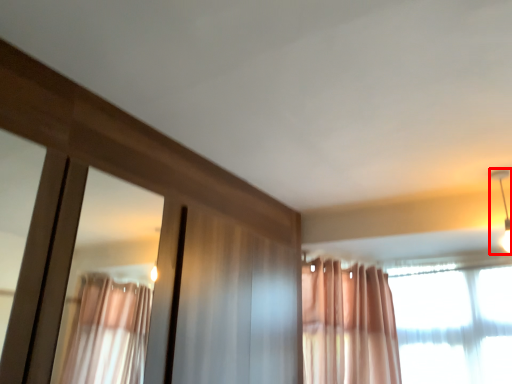
Question: Observing the image, what is the correct spatial positioning of light fixture (annotated by the red box) in reference to curtain?

Choices:
 (A) left
 (B) right

Answer: (B)